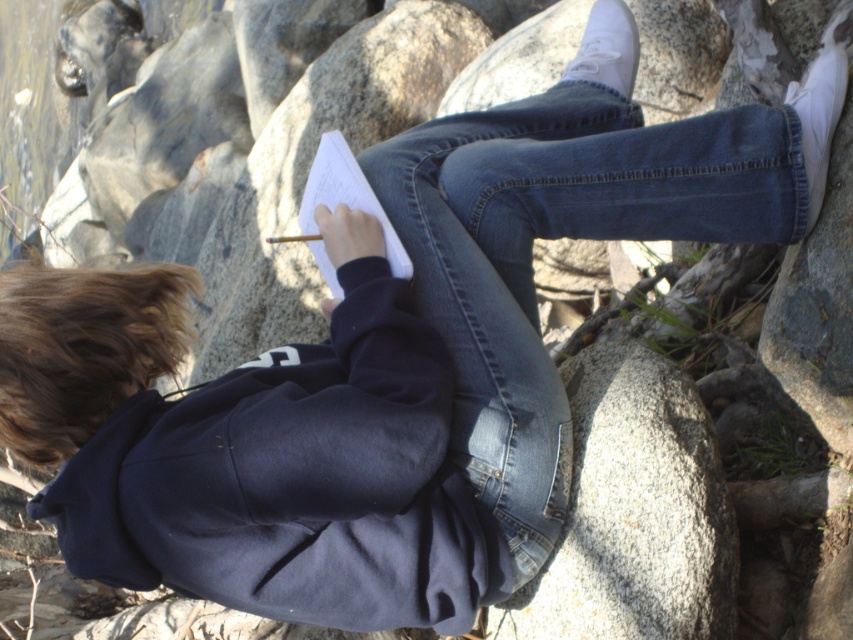
You are a photographer trying to capture the scene of a person sitting on rocks outdoors. You notice a point marked at coordinates (82, 348). Based on the description, what object is located at that point?

The point at (82, 348) indicates brown fuzzy hair at upper left.

From the picture: You are a photographer trying to capture the person in the scene. Since the denim at center and the white paper at center are both at the center, which one should you focus on to ensure the subject is properly framed?

The denim at center is bigger than the white paper at center, so focusing on the denim at center will ensure the subject is properly framed.